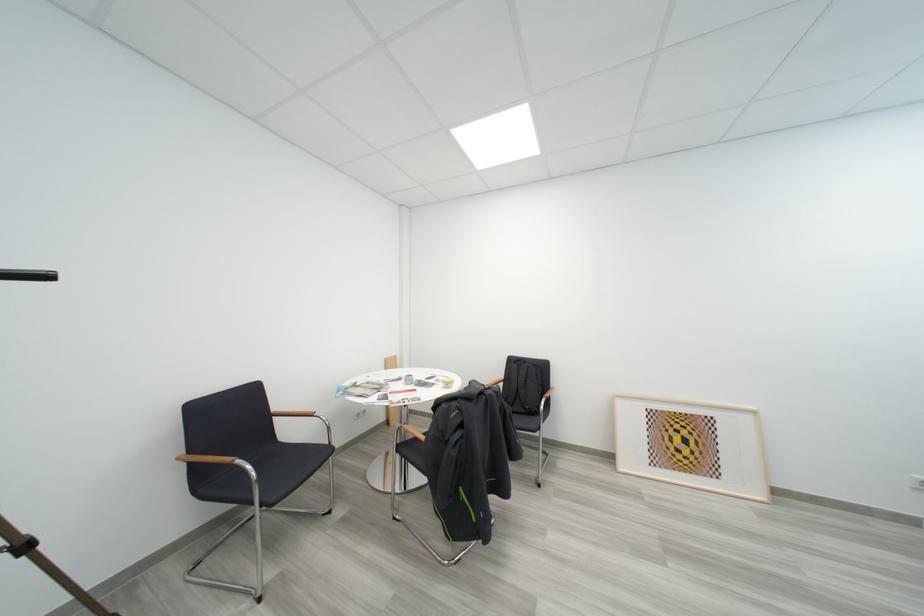
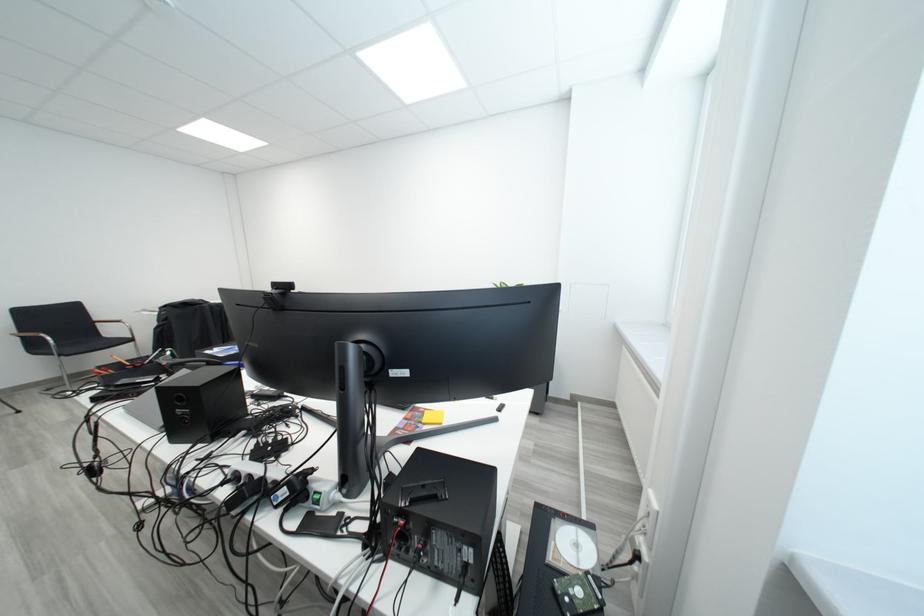
Based on the photo, what movement of the cameraman would produce the second image?

The cameraman moved toward right, backward.